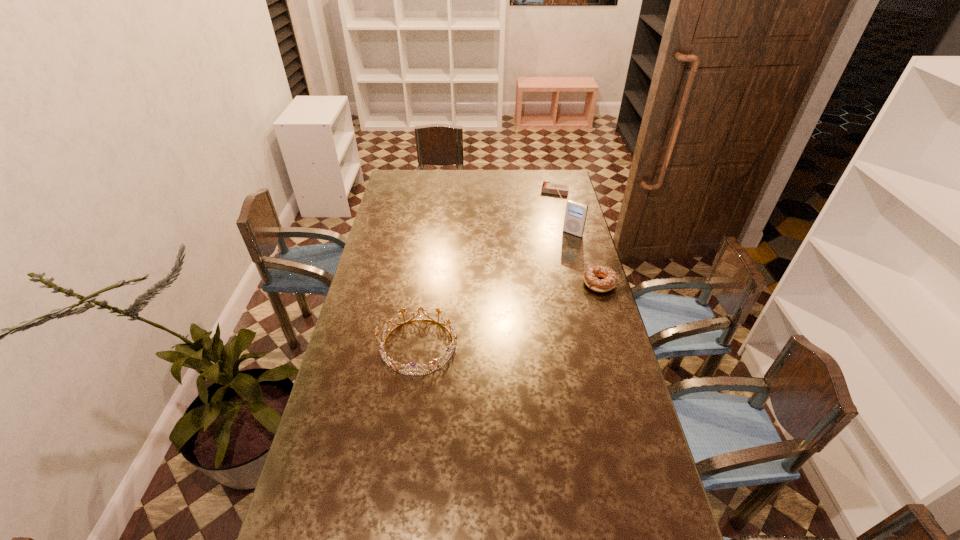
At what (x,y) coordinates should I click in order to perform the action: click on free space on the desktop that is between the tiara and the third tallest object and is positioned on the front-facing side of the second farthest object. Please return your answer as a coordinate pair (x, y). Looking at the image, I should click on (505, 316).

Locate an element on the screen. Image resolution: width=960 pixels, height=540 pixels. free spot on the desktop that is between the leftmost object and the third tallest object and is positioned on the striking surface of the shortest object is located at coordinates (530, 308).